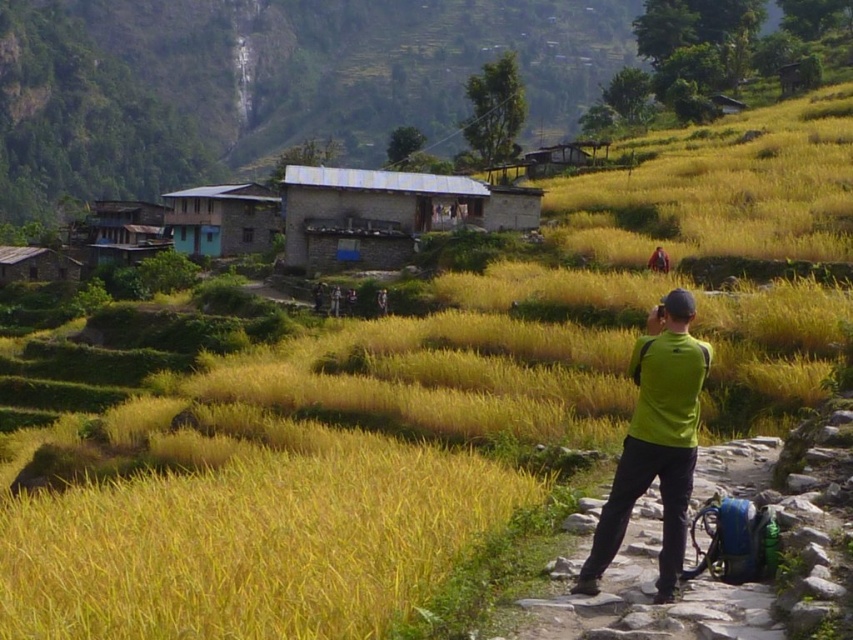
From the picture: You are a hiker who wants to take a photo of the blue painted wooden hut at center from where the person in the green fabric shirt at right is standing. Considering the distance between them, do you think you can capture the entire hut in your camera frame without moving closer?

The green fabric shirt at right and blue painted wooden hut at center are 262.53 feet apart from each other. At this distance, capturing the entire blue painted wooden hut at center in the camera frame from the green fabric shirt at right position might be challenging unless using a wide angle lens or zooming out sufficiently.

You are a hiker who wants to take shelter from the rain. You see the gray stone hut at center and the green fabric shirt at right. Which one is bigger and can provide better shelter?

The gray stone hut at center is larger in size than the green fabric shirt at right, so it can provide better shelter.